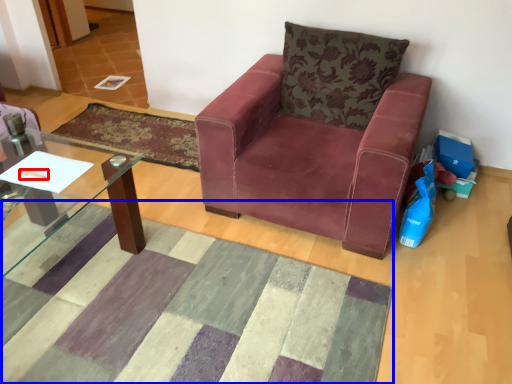
Question: Among these objects, which one is farthest to the camera, pen (highlighted by a red box) or mat (highlighted by a blue box)?

Choices:
 (A) pen
 (B) mat

Answer: (A)